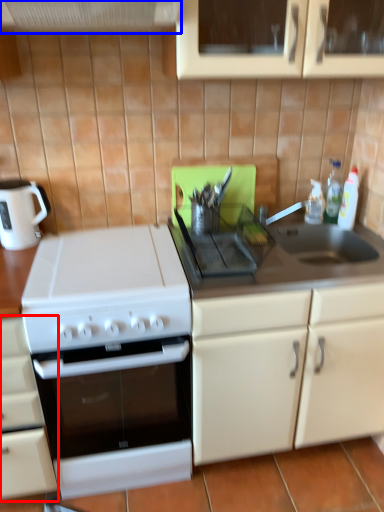
Question: Among these objects, which one is nearest to the camera, cabinetry (highlighted by a red box) or exhaust hood (highlighted by a blue box)?

Choices:
 (A) cabinetry
 (B) exhaust hood

Answer: (B)